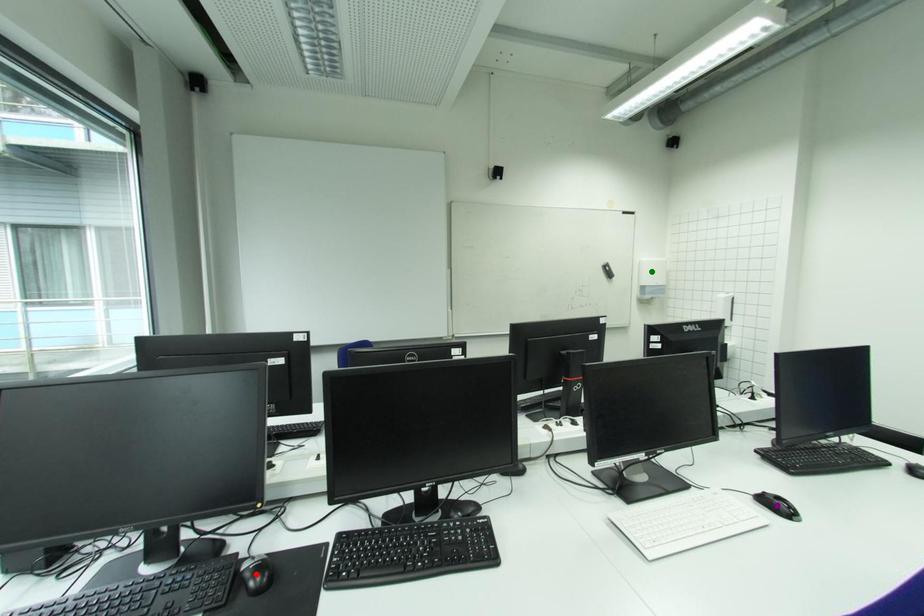
Order these from nearest to farthest:
purple point | green point | red point

red point → purple point → green point